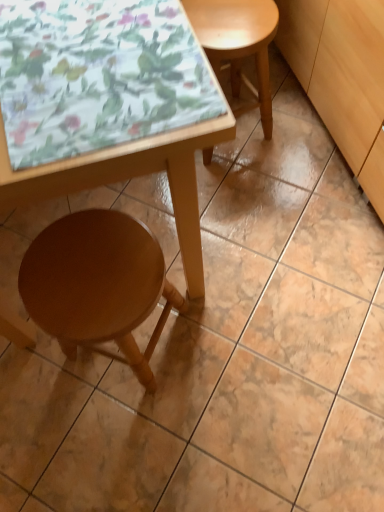
Question: Does wooden table at lower left have a greater width compared to wooden stool at lower left, the 2th stool when ordered from right to left?

Choices:
 (A) no
 (B) yes

Answer: (B)

Question: Is wooden table at lower left directly adjacent to wooden stool at lower left, the 2th stool when ordered from right to left?

Choices:
 (A) yes
 (B) no

Answer: (B)

Question: Does wooden table at lower left have a lesser height compared to wooden stool at lower left, which ranks as the second stool in top-to-bottom order?

Choices:
 (A) no
 (B) yes

Answer: (A)

Question: From a real-world perspective, is wooden table at lower left physically below wooden stool at lower left, acting as the 1th stool starting from the bottom?

Choices:
 (A) no
 (B) yes

Answer: (A)

Question: From a real-world perspective, is wooden table at lower left on wooden stool at lower left, the first stool viewed from the left?

Choices:
 (A) no
 (B) yes

Answer: (B)

Question: Can you confirm if wooden table at lower left is thinner than wooden stool at lower left, the 2th stool when ordered from right to left?

Choices:
 (A) no
 (B) yes

Answer: (A)

Question: Is wooden stool at lower left, acting as the 1th stool starting from the bottom, at the right side of wooden table at lower left?

Choices:
 (A) no
 (B) yes

Answer: (B)

Question: Are wooden stool at lower left, which ranks as the second stool in top-to-bottom order, and wooden table at lower left located far from each other?

Choices:
 (A) no
 (B) yes

Answer: (A)

Question: From the image's perspective, would you say wooden stool at lower left, the first stool viewed from the left, is positioned over wooden table at lower left?

Choices:
 (A) yes
 (B) no

Answer: (B)

Question: Can you confirm if wooden stool at lower left, the 2th stool when ordered from right to left, is shorter than wooden table at lower left?

Choices:
 (A) yes
 (B) no

Answer: (A)

Question: Is wooden stool at lower left, which ranks as the second stool in top-to-bottom order, looking in the opposite direction of wooden table at lower left?

Choices:
 (A) no
 (B) yes

Answer: (B)

Question: From the image's perspective, is wooden stool at lower left, which ranks as the second stool in top-to-bottom order, under wooden table at lower left?

Choices:
 (A) yes
 (B) no

Answer: (A)

Question: Does wooden table at lower left have a larger size compared to light wood cabinet at lower right?

Choices:
 (A) yes
 (B) no

Answer: (A)